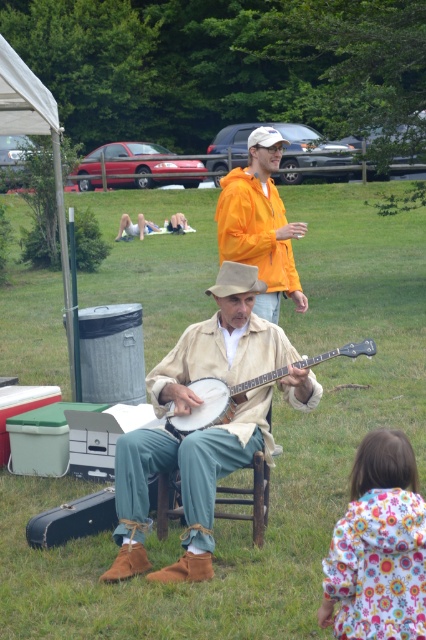
You are a photographer standing at the center of the scene. You want to take a picture of the wooden banjo at center. Where should you position your camera to capture the banjo in the frame?

The wooden banjo at center is already positioned at point 0.628 on the x and 0.509 on the y coordinates, so the camera should be aligned to focus on those coordinates to capture the banjo in the frame.

You are standing in the grassy area and want to find the orange matte jacket at upper center. Based on the coordinates provided, in which direction should you look relative to the seated man?

The orange matte jacket at upper center is located at point (259, 224), which is to the upper right direction relative to the seated man.

You are a photographer trying to capture the scene. You notice the orange matte jacket at upper center and the beige felt cowboy hat at center. Which object is covering part of the other one?

The orange matte jacket at upper center is positioned over the beige felt cowboy hat at center, so it is covering part of it.